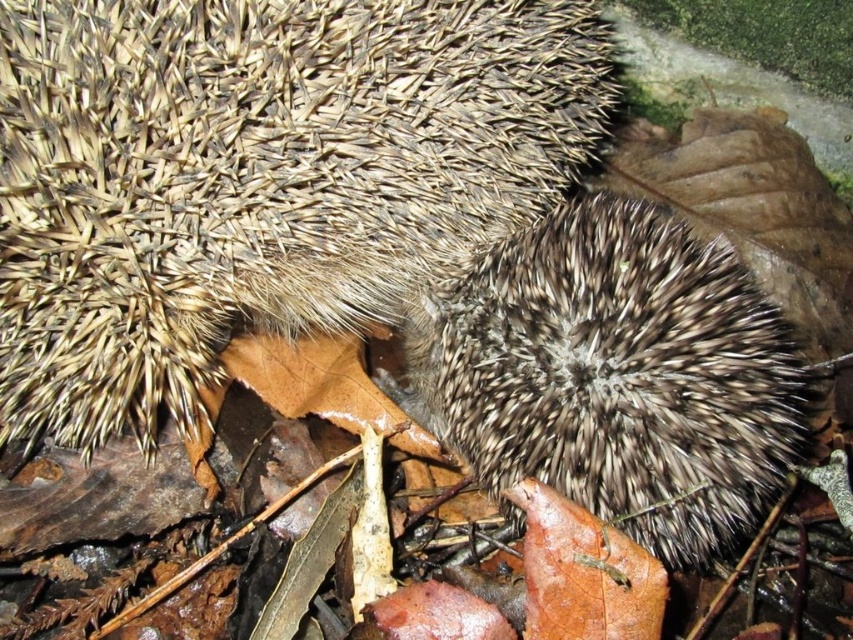
Does brown spiny hedgehog at center have a larger size compared to spiky brown hedgehog at center?

Yes.

Is brown spiny hedgehog at center below spiky brown hedgehog at center?

Incorrect, brown spiny hedgehog at center is not positioned below spiky brown hedgehog at center.

Between point (276, 67) and point (762, 492), which one is positioned behind?

The point (762, 492) is behind.

I want to click on brown spiny hedgehog at center, so click(x=259, y=177).